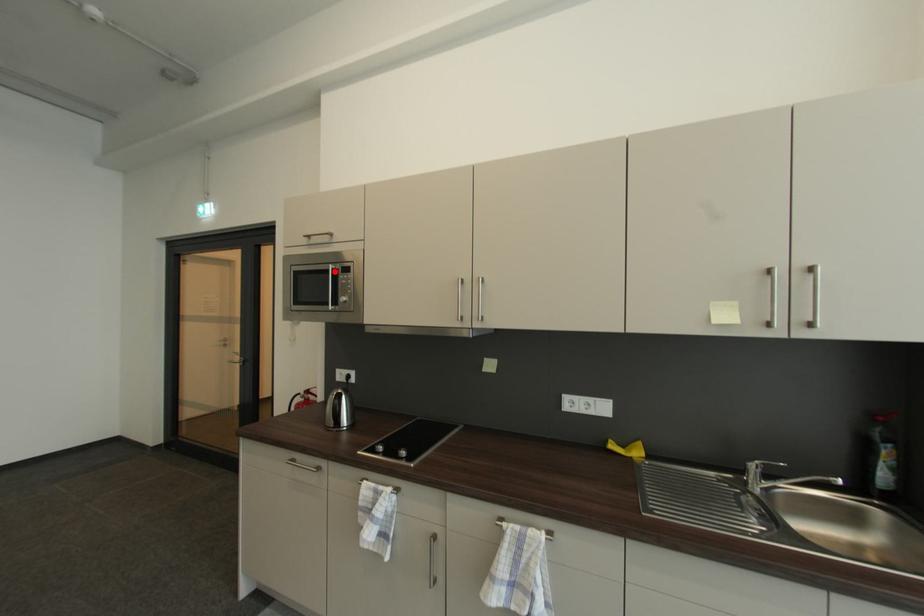
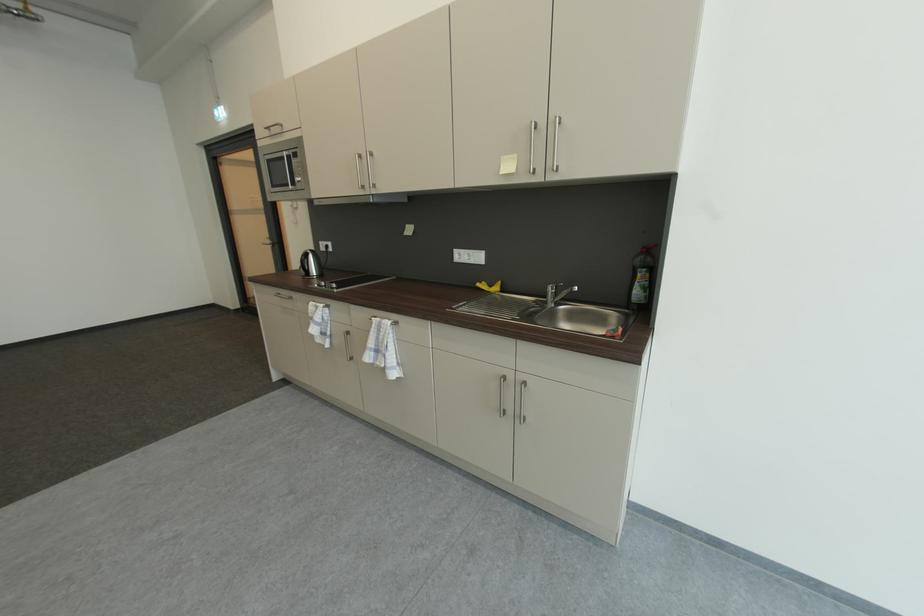
Where in the second image is the point corresponding to the highlighted location from the first image?

(290, 158)